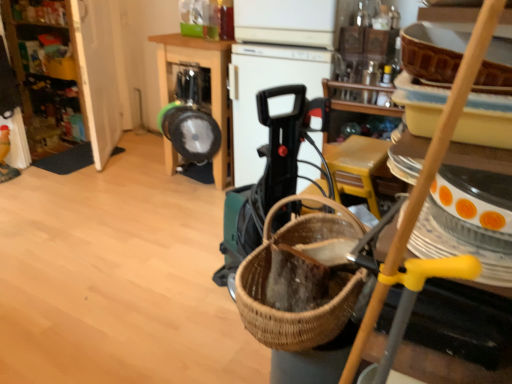
Question: Can you confirm if metallic silver blender at center, which is the 1th appliance in left-to-right order, is bigger than black plastic vacuum cleaner at center, acting as the first appliance starting from the right?

Choices:
 (A) yes
 (B) no

Answer: (B)

Question: Is metallic silver blender at center, placed as the 2th appliance when sorted from right to left, completely or partially outside of black plastic vacuum cleaner at center, acting as the first appliance starting from the right?

Choices:
 (A) no
 (B) yes

Answer: (B)

Question: From a real-world perspective, does metallic silver blender at center, placed as the 2th appliance when sorted from right to left, sit lower than black plastic vacuum cleaner at center, acting as the first appliance starting from the right?

Choices:
 (A) no
 (B) yes

Answer: (A)

Question: Considering the relative sizes of metallic silver blender at center, placed as the 2th appliance when sorted from right to left, and black plastic vacuum cleaner at center, the second appliance in the left-to-right sequence, in the image provided, is metallic silver blender at center, placed as the 2th appliance when sorted from right to left, taller than black plastic vacuum cleaner at center, the second appliance in the left-to-right sequence,?

Choices:
 (A) no
 (B) yes

Answer: (A)

Question: Is black plastic vacuum cleaner at center, acting as the first appliance starting from the right, a part of metallic silver blender at center, which is the 1th appliance in left-to-right order?

Choices:
 (A) no
 (B) yes

Answer: (A)

Question: From the image's perspective, is metallic silver frying pan at center positioned above or below wooden cabinet at left?

Choices:
 (A) below
 (B) above

Answer: (A)

Question: Considering their positions, is metallic silver frying pan at center located in front of or behind wooden cabinet at left?

Choices:
 (A) front
 (B) behind

Answer: (A)

Question: In terms of width, does metallic silver frying pan at center look wider or thinner when compared to wooden cabinet at left?

Choices:
 (A) thin
 (B) wide

Answer: (B)

Question: Based on their sizes in the image, would you say metallic silver frying pan at center is bigger or smaller than wooden cabinet at left?

Choices:
 (A) big
 (B) small

Answer: (A)

Question: From a real-world perspective, is metallic silver frying pan at center positioned above or below black plastic vacuum cleaner at center, acting as the first appliance starting from the right?

Choices:
 (A) below
 (B) above

Answer: (A)

Question: Relative to black plastic vacuum cleaner at center, acting as the first appliance starting from the right, is metallic silver frying pan at center in front or behind?

Choices:
 (A) behind
 (B) front

Answer: (A)

Question: In terms of width, does metallic silver frying pan at center look wider or thinner when compared to black plastic vacuum cleaner at center, the second appliance in the left-to-right sequence?

Choices:
 (A) thin
 (B) wide

Answer: (B)

Question: From the image's perspective, relative to black plastic vacuum cleaner at center, the second appliance in the left-to-right sequence, is metallic silver frying pan at center above or below?

Choices:
 (A) below
 (B) above

Answer: (B)

Question: From the image's perspective, is black plastic vacuum cleaner at center, acting as the first appliance starting from the right, positioned above or below metallic silver blender at center, placed as the 2th appliance when sorted from right to left?

Choices:
 (A) below
 (B) above

Answer: (A)

Question: In terms of width, does black plastic vacuum cleaner at center, the second appliance in the left-to-right sequence, look wider or thinner when compared to metallic silver blender at center, which is the 1th appliance in left-to-right order?

Choices:
 (A) thin
 (B) wide

Answer: (B)